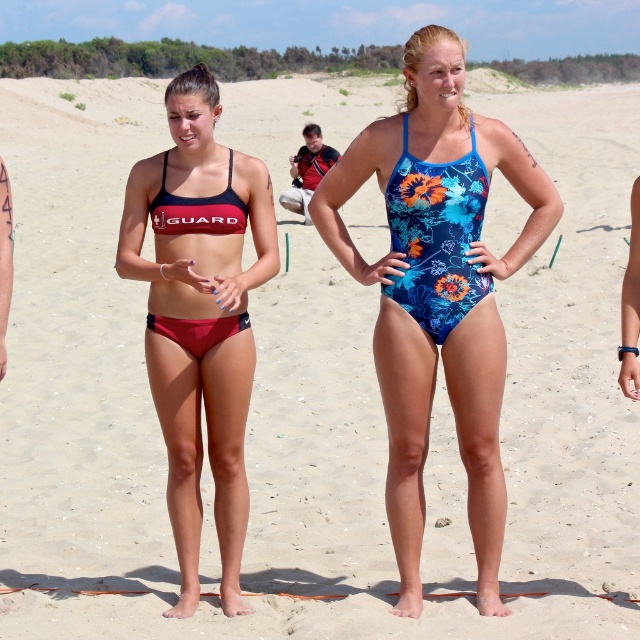
Question: Considering the relative positions of floral print swimsuit at center and matte red bikini top at center in the image provided, where is floral print swimsuit at center located with respect to matte red bikini top at center?

Choices:
 (A) left
 (B) right

Answer: (B)

Question: Estimate the real-world distances between objects in this image. Which object is closer to the floral printed swimsuit at center?

Choices:
 (A) floral print swimsuit at center
 (B) matte red bikini top at center

Answer: (A)

Question: Estimate the real-world distances between objects in this image. Which object is farther from the matte red bikini top at center?

Choices:
 (A) matte red bikini bottom at left
 (B) floral printed swimsuit at center
 (C) floral print swimsuit at center

Answer: (B)

Question: Can you confirm if floral print swimsuit at center is smaller than matte red bikini top at center?

Choices:
 (A) no
 (B) yes

Answer: (A)

Question: Where is floral printed swimsuit at center located in relation to matte red bikini bottom at left in the image?

Choices:
 (A) right
 (B) left

Answer: (A)

Question: Which point is farther to the camera?

Choices:
 (A) (244, 218)
 (B) (228, 472)
 (C) (401, 310)
 (D) (444, 220)

Answer: (A)